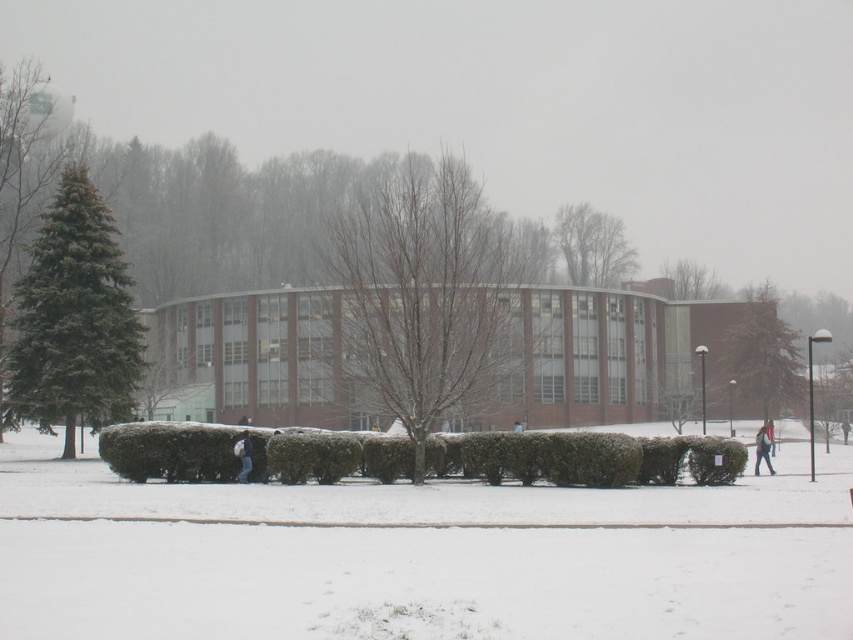
Who is shorter, green matte evergreen tree at left or green leafy tree at upper center?

green leafy tree at upper center is shorter.

Does green matte evergreen tree at left have a lesser width compared to green leafy tree at upper center?

Yes, green matte evergreen tree at left is thinner than green leafy tree at upper center.

Does point (135, 364) come in front of point (670, 268)?

Yes, point (135, 364) is closer to viewer.

The width and height of the screenshot is (853, 640). Find the location of `green matte evergreen tree at left`. green matte evergreen tree at left is located at coordinates 74,317.

Between point (567, 236) and point (242, 481), which one is positioned behind?

The point (567, 236) is more distant.

Between point (590, 241) and point (247, 465), which one is positioned in front?

Point (247, 465) is in front.

Find the location of `bare branches at upper center`. bare branches at upper center is located at coordinates (592, 246).

Does bare branches at upper center lie in front of light blue jeans at lower right?

No, bare branches at upper center is behind light blue jeans at lower right.

Who is higher up, bare branches at upper center or light blue jeans at lower right?

bare branches at upper center

Locate an element on the screen. bare branches at upper center is located at coordinates (592, 246).